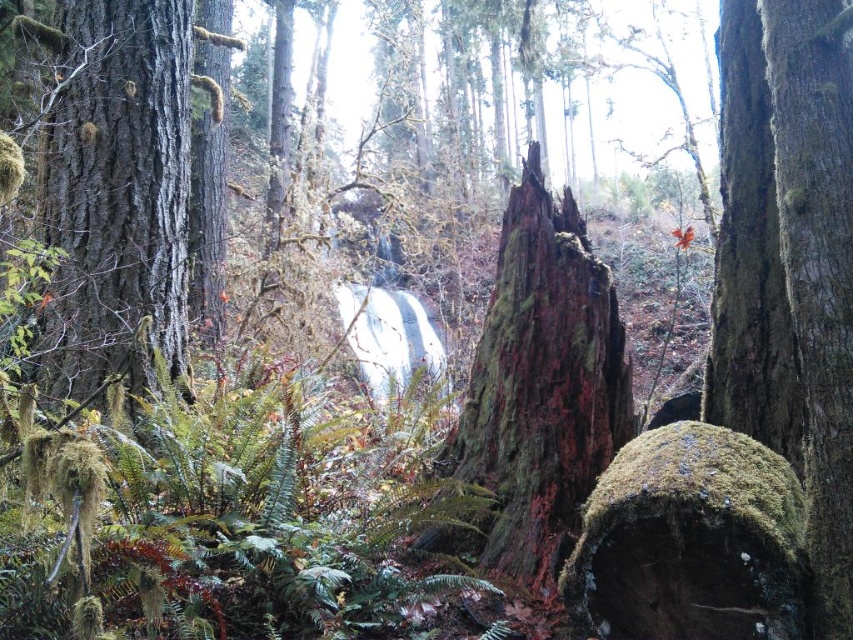
Question: Can you confirm if smooth bark tree trunk at left is positioned above green mossy boulder at center?

Choices:
 (A) yes
 (B) no

Answer: (A)

Question: Does green mossy tree trunk at center come in front of green mossy bark at right?

Choices:
 (A) yes
 (B) no

Answer: (B)

Question: Estimate the real-world distances between objects in this image. Which object is closer to the green mossy boulder at center?

Choices:
 (A) green mossy tree trunk at center
 (B) smooth bark tree trunk at left

Answer: (A)

Question: Which of these objects is positioned closest to the smooth bark tree trunk at left?

Choices:
 (A) green mossy tree trunk at center
 (B) green mossy bark at right

Answer: (A)

Question: Does green mossy boulder at center appear over green mossy bark at right?

Choices:
 (A) no
 (B) yes

Answer: (A)

Question: Which object appears farthest from the camera in this image?

Choices:
 (A) smooth bark tree trunk at left
 (B) green mossy boulder at center

Answer: (A)